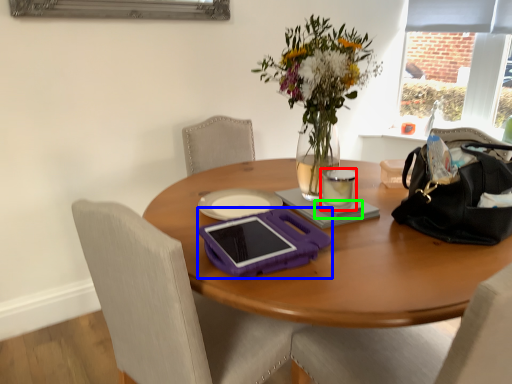
Question: Which object is positioned farthest from coffee cup (highlighted by a red box)? Select from tablet computer (highlighted by a blue box) and notepad (highlighted by a green box).

Choices:
 (A) tablet computer
 (B) notepad

Answer: (A)